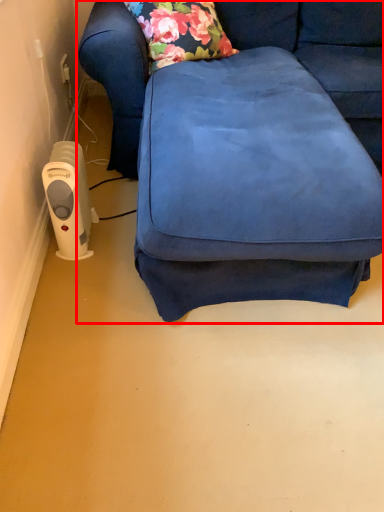
Question: From the image's perspective, where is studio couch (annotated by the red box) located in relation to appliance in the image?

Choices:
 (A) above
 (B) below

Answer: (A)